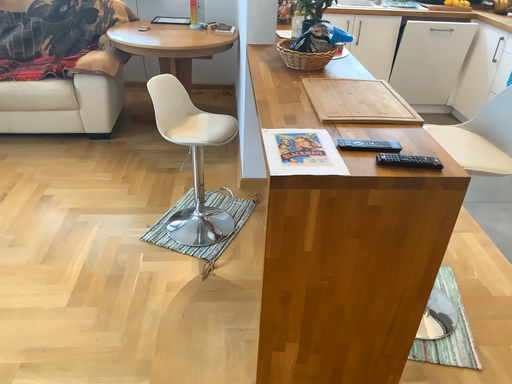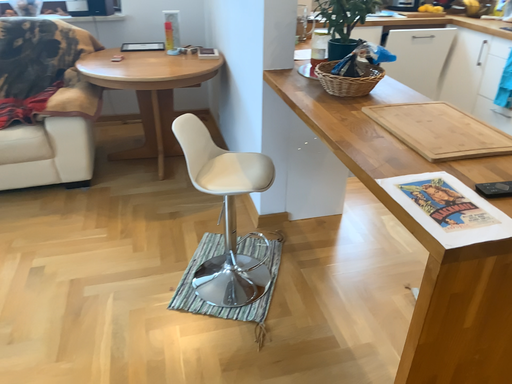
Question: How did the camera likely rotate when shooting the video?

Choices:
 (A) rotated right
 (B) rotated left

Answer: (A)